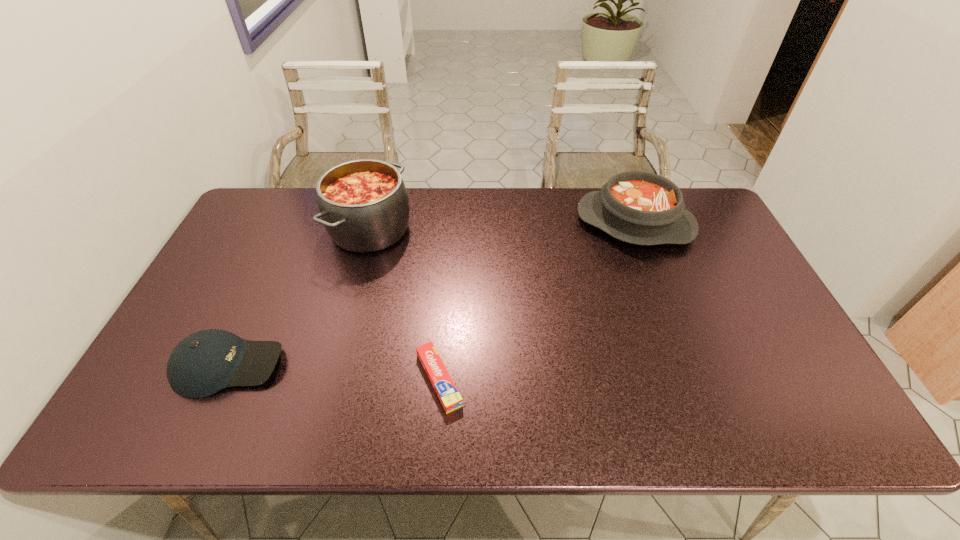
Find the location of `blank space located 0.050m on the front of the second object from right to left`. blank space located 0.050m on the front of the second object from right to left is located at coordinates (435, 436).

You are a GUI agent. You are given a task and a screenshot of the screen. Output one action in this format:
    pyautogui.click(x=<x>, y=<y>)
    Task: Click on the object that is positioned at the near edge
    The height and width of the screenshot is (540, 960).
    Given the screenshot: What is the action you would take?
    pyautogui.click(x=450, y=398)

This screenshot has height=540, width=960. I want to click on object located at the left edge, so click(205, 362).

Find the location of a particular element. The height and width of the screenshot is (540, 960). object present at the right edge is located at coordinates (637, 207).

What are the coordinates of `object present at the far right corner` in the screenshot? It's located at (637, 207).

In the image, there is a desktop. Find the location of `vacant space at the far edge`. vacant space at the far edge is located at coordinates (498, 220).

In the image, there is a desktop. At what (x,y) coordinates should I click in order to perform the action: click on vacant space at the near edge. Please return your answer as a coordinate pair (x, y). The height and width of the screenshot is (540, 960). Looking at the image, I should click on (741, 436).

In the image, there is a desktop. Find the location of `vacant space at the left edge`. vacant space at the left edge is located at coordinates (244, 295).

Find the location of a particular element. The image size is (960, 540). free region at the right edge is located at coordinates (748, 368).

Find the location of a particular element. This screenshot has width=960, height=540. vacant space at the near right corner is located at coordinates (833, 424).